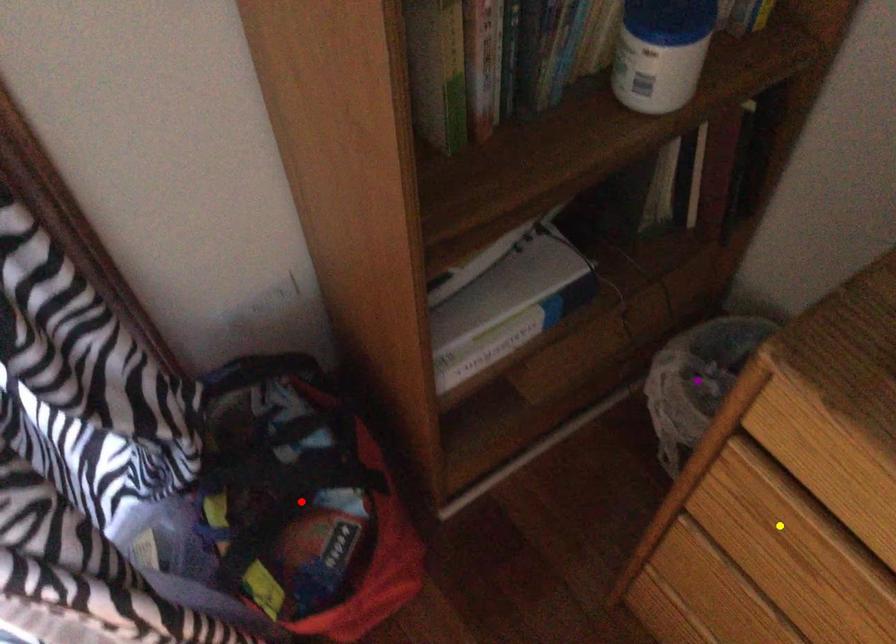
Order these from farthest to nearest:
- purple point
- yellow point
- red point

purple point < red point < yellow point